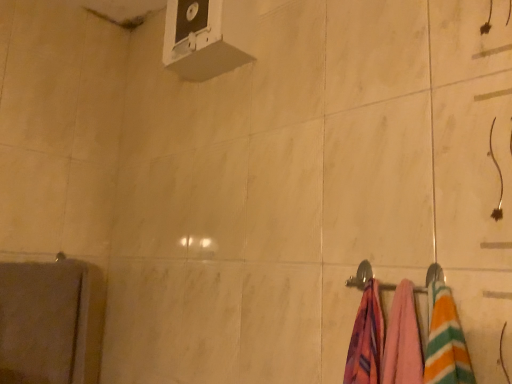
In order to face gray textured towel at lower left, should I rotate leftwards or rightwards?

Turn left approximately 26.207 degrees to face it.

Describe the element at coordinates (42, 323) in the screenshot. The height and width of the screenshot is (384, 512). I see `gray textured towel at lower left` at that location.

Identify the location of gray textured towel at lower left. This screenshot has height=384, width=512. (42, 323).

Measure the distance between gray textured towel at lower left and camera.

A distance of 3.98 feet exists between gray textured towel at lower left and camera.

Where is `gray textured towel at lower left`? The image size is (512, 384). gray textured towel at lower left is located at coordinates (42, 323).